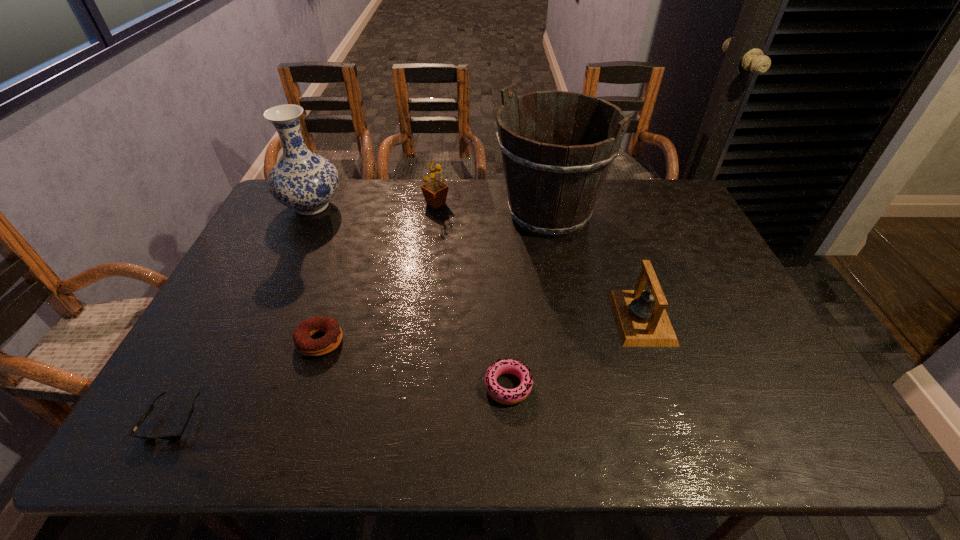
Find the location of a particular element. vacant space that satisfies the following two spatial constraints: 1. at the front of the sunflower with flowers visible; 2. on the back side of the fourth tallest object is located at coordinates (421, 318).

Identify the location of vacant space that satisfies the following two spatial constraints: 1. on the front side of the right doughnut; 2. on the left side of the vase. This screenshot has height=540, width=960. (228, 386).

You are a GUI agent. You are given a task and a screenshot of the screen. Output one action in this format:
    pyautogui.click(x=<x>, y=<y>)
    Task: Click on the vacant position in the image that satisfies the following two spatial constraints: 1. at the front of the nearer doughnut with flowers visible; 2. on the left side of the fourth object from right to left
    Image resolution: width=960 pixels, height=540 pixels.
    Given the screenshot: What is the action you would take?
    pyautogui.click(x=413, y=386)